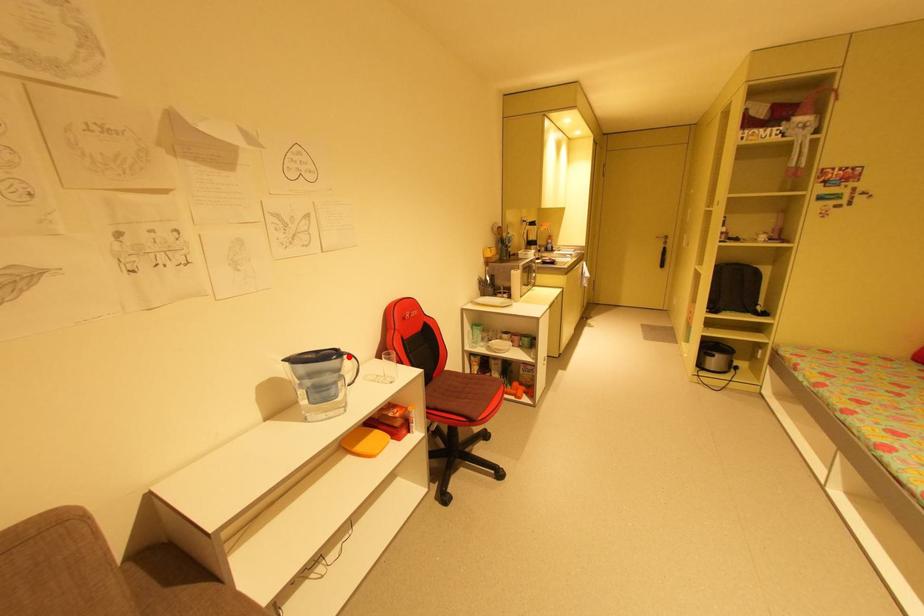
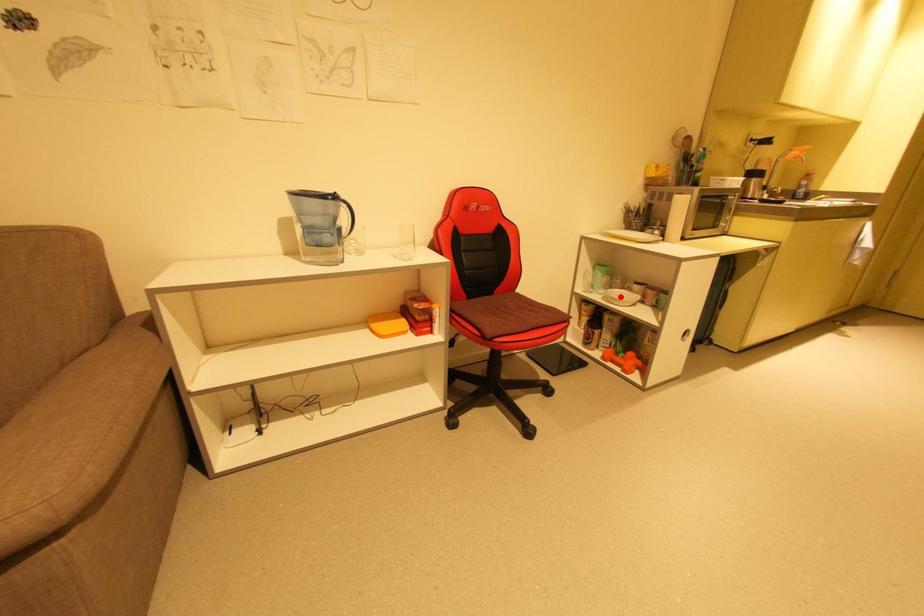
Looking at this image, I am providing you with two images of the same scene from different viewpoints. A red point is marked on the first image and another point is marked on the second image. Is the red point in image1 aligned with the point shown in image2?

No